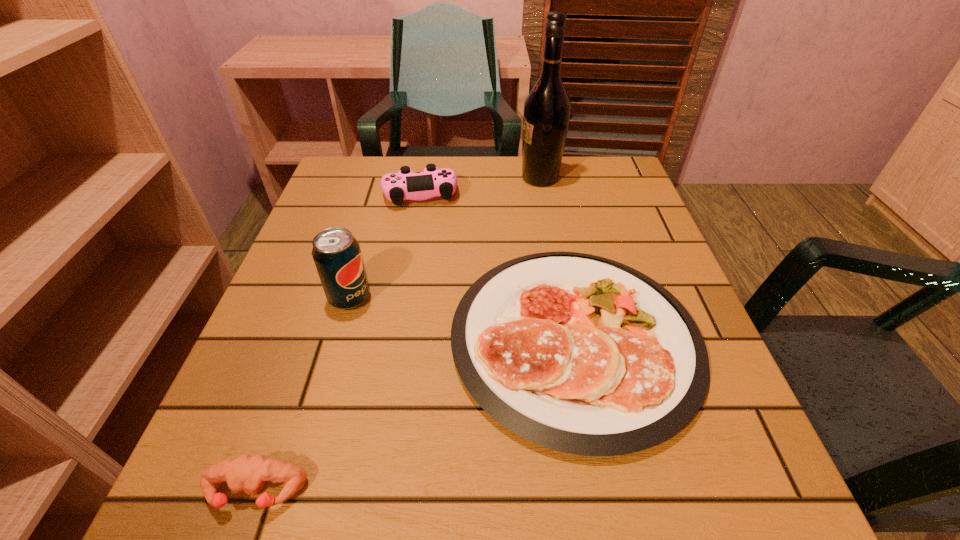
You are a GUI agent. You are given a task and a screenshot of the screen. Output one action in this format:
    pyautogui.click(x=<x>, y=<y>)
    Task: Click on the free region located on the left of the dish
    The height and width of the screenshot is (540, 960).
    Given the screenshot: What is the action you would take?
    (x=334, y=340)

Image resolution: width=960 pixels, height=540 pixels. I want to click on wine bottle located at the far edge, so tap(547, 108).

Image resolution: width=960 pixels, height=540 pixels. I want to click on control located in the far edge section of the desktop, so click(405, 185).

Where is `dish situated at the near edge`? This screenshot has width=960, height=540. dish situated at the near edge is located at coordinates (578, 353).

The height and width of the screenshot is (540, 960). I want to click on puncher that is positioned at the near edge, so click(x=247, y=473).

I want to click on soda can present at the left edge, so click(336, 252).

Locate an element on the screen. The image size is (960, 540). control present at the left edge is located at coordinates (405, 185).

The height and width of the screenshot is (540, 960). I want to click on puncher that is positioned at the left edge, so click(247, 473).

Image resolution: width=960 pixels, height=540 pixels. Identify the location of object at the right edge. (578, 353).

Locate an element on the screen. This screenshot has height=540, width=960. object positioned at the far left corner is located at coordinates (405, 185).